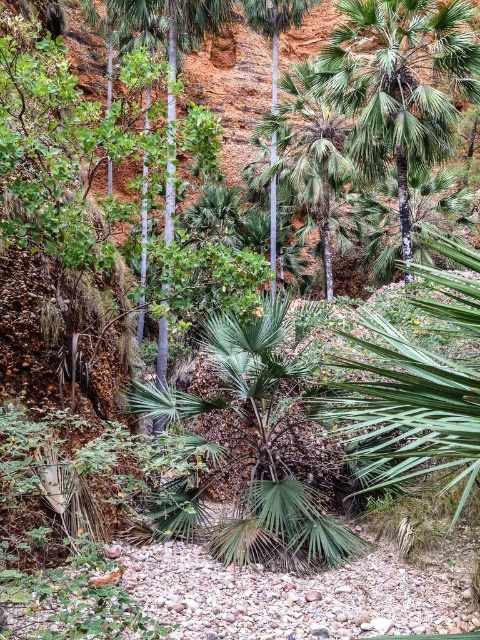
You are standing in the middle of the rocky terrain and see the green leafy palm tree at upper center and the green leafy palm tree at center. Which one is taller?

The green leafy palm tree at center is taller than the green leafy palm tree at upper center.

You are an environmental scientist studying palm trees in this landscape. You notice two palm trees labeled as the green leafy palm tree at upper center and the green leafy palm tree at center. Which of these two palm trees is smaller in size?

The green leafy palm tree at upper center is smaller in size compared to the green leafy palm tree at center according to the description.